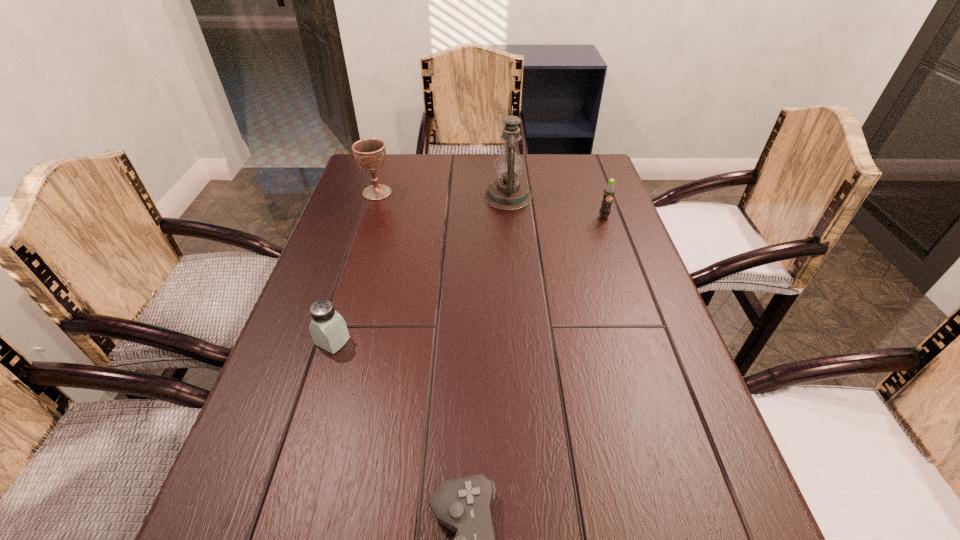
Where is `oil lamp`? The height and width of the screenshot is (540, 960). oil lamp is located at coordinates (507, 192).

At what (x,y) coordinates should I click in order to perform the action: click on chalice. Please return your answer as a coordinate pair (x, y). Looking at the image, I should click on (370, 153).

Where is `the third farthest object`? the third farthest object is located at coordinates (609, 191).

Identify the location of the rightmost object. (609, 191).

This screenshot has height=540, width=960. I want to click on saltshaker, so click(328, 329).

Find the location of a particular element. This screenshot has height=540, width=960. free space located 0.350m on the front of the oil lamp is located at coordinates (516, 294).

Image resolution: width=960 pixels, height=540 pixels. I want to click on vacant space located on the right of the fourth shortest object, so click(x=479, y=193).

The height and width of the screenshot is (540, 960). In order to click on vacant space located on the front label of the rightmost object in this screenshot , I will do `click(627, 282)`.

Identify the location of free point located 0.310m on the back of the fourth farthest object. (364, 241).

Locate an element on the screen. oil lamp that is at the far edge is located at coordinates (507, 192).